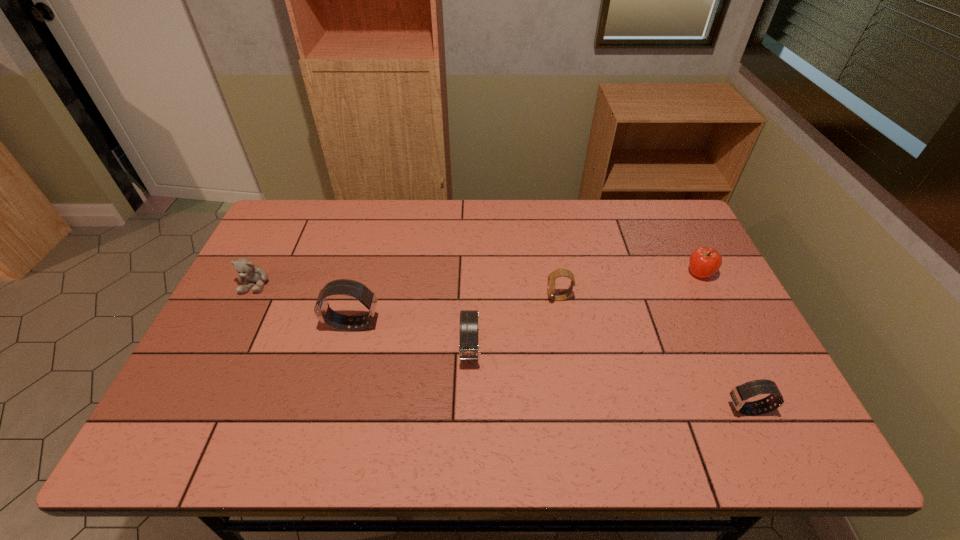
I want to click on vacant space situated on the face of the farthest watch, so click(x=506, y=298).

The height and width of the screenshot is (540, 960). Find the location of `vacant space located 0.110m on the face of the teddy bear`. vacant space located 0.110m on the face of the teddy bear is located at coordinates (234, 326).

Image resolution: width=960 pixels, height=540 pixels. What are the coordinates of `object that is at the near edge` in the screenshot? It's located at (x=739, y=394).

This screenshot has width=960, height=540. I want to click on object that is at the left edge, so click(246, 269).

The width and height of the screenshot is (960, 540). I want to click on watch that is positioned at the right edge, so click(x=739, y=394).

Locate an element on the screen. This screenshot has height=540, width=960. apple located in the right edge section of the desktop is located at coordinates (704, 262).

Where is `object that is at the near right corner`? The width and height of the screenshot is (960, 540). object that is at the near right corner is located at coordinates (739, 394).

Find the location of a particular element. blank space at the far edge of the desktop is located at coordinates (459, 222).

The image size is (960, 540). Find the location of `vacant space at the near edge of the desktop`. vacant space at the near edge of the desktop is located at coordinates (330, 381).

Where is `vacant space at the left edge of the desktop`? The height and width of the screenshot is (540, 960). vacant space at the left edge of the desktop is located at coordinates (207, 373).